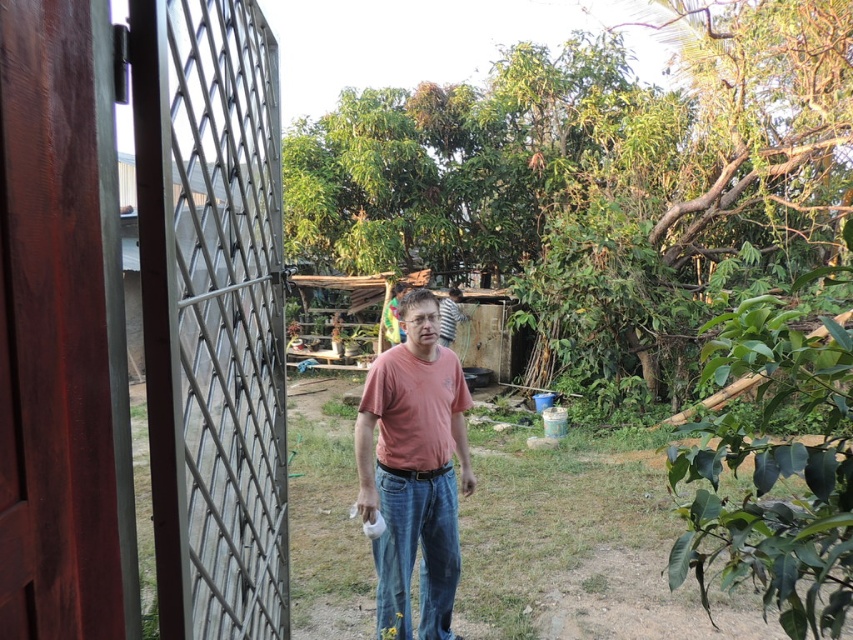
Question: Which of the following is the farthest from the observer?

Choices:
 (A) (384, 554)
 (B) (230, 13)

Answer: (A)

Question: Which of the following is the farthest from the observer?

Choices:
 (A) (372, 461)
 (B) (96, 442)

Answer: (A)

Question: Is brown wooden gate at left bigger than matte pink t-shirt at center?

Choices:
 (A) yes
 (B) no

Answer: (B)

Question: Which point is closer to the camera?

Choices:
 (A) brown wooden gate at left
 (B) matte pink t-shirt at center

Answer: (A)

Question: Is brown wooden gate at left wider than matte pink t-shirt at center?

Choices:
 (A) yes
 (B) no

Answer: (B)

Question: Can you confirm if brown wooden gate at left is bigger than matte pink t-shirt at center?

Choices:
 (A) yes
 (B) no

Answer: (B)